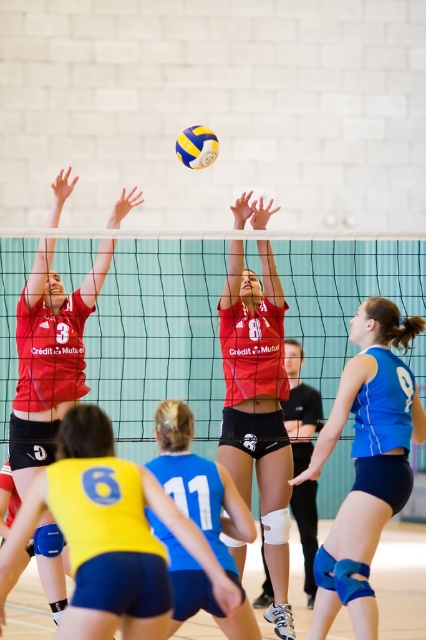
Is matte red volleyball at center wider than yellow matte/vinyl volleyball at upper center?

Indeed, matte red volleyball at center has a greater width compared to yellow matte/vinyl volleyball at upper center.

Can you confirm if matte red volleyball at center is positioned to the right of yellow matte/vinyl volleyball at upper center?

Correct, you'll find matte red volleyball at center to the right of yellow matte/vinyl volleyball at upper center.

Who is more distant from viewer, (284, 525) or (210, 157)?

Positioned behind is point (210, 157).

Where is `matte red volleyball at center`? matte red volleyball at center is located at coordinates click(258, 406).

Who is higher up, blue matte knee pads at center or yellow matte/vinyl volleyball at upper center?

Positioned higher is yellow matte/vinyl volleyball at upper center.

Is blue matte knee pads at center shorter than yellow matte/vinyl volleyball at upper center?

No.

Is point (368, 556) positioned behind point (189, 140)?

No, it is not.

The image size is (426, 640). In order to click on blue matte knee pads at center in this screenshot , I will do coord(367,461).

Is green mesh net at center closer to camera compared to yellow matte/vinyl volleyball at upper center?

That is True.

Is point (178, 396) positioned behind point (207, 129)?

Yes, it is.

This screenshot has width=426, height=640. I want to click on green mesh net at center, so click(x=203, y=314).